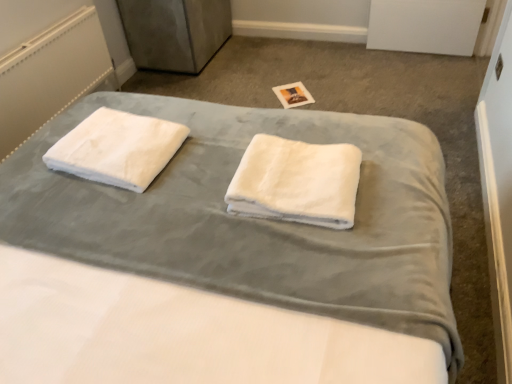
The image size is (512, 384). Identify the location of empty space that is ontop of white fluffy towel at center, the 2th towel positioned from the left (from a real-world perspective). (x=290, y=165).